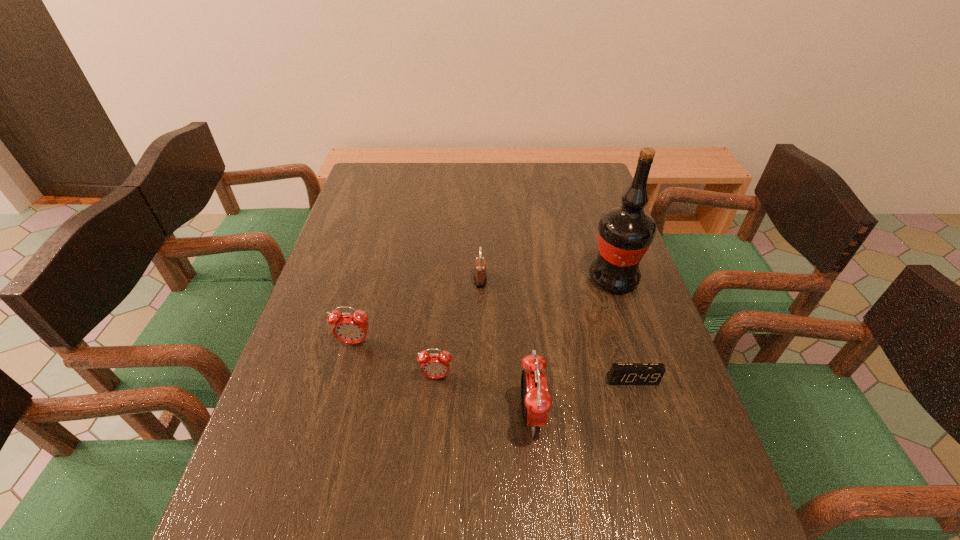
Observe the arrangement of all alarm clocks in the image. To keep them evenly spaced, where would you place another alarm clock on the right? Please locate a free space. Please provide its 2D coordinates. Your answer should be formatted as a tuple, i.e. [(x, y)], where the tuple contains the x and y coordinates of a point satisfying the conditions above.

[(641, 463)]